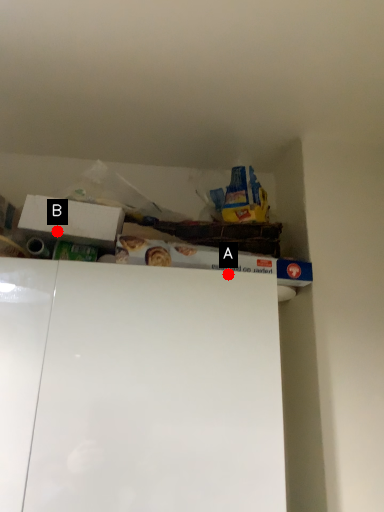
Question: Two points are circled on the image, labeled by A and B beside each circle. Which point is closer to the camera?

Choices:
 (A) A is closer
 (B) B is closer

Answer: (A)